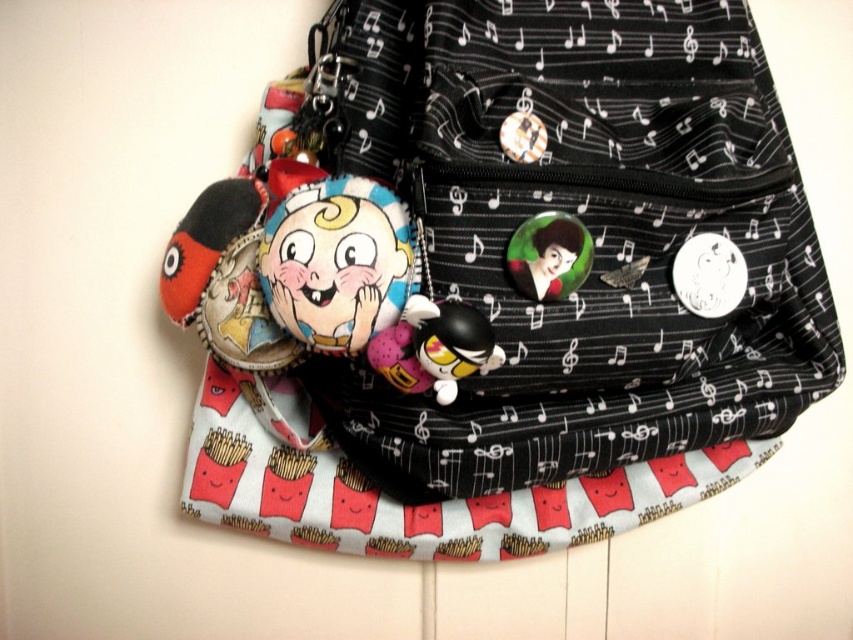
Question: In this image, where is soft plush toy at center located relative to shiny metallic button at center?

Choices:
 (A) below
 (B) above

Answer: (A)

Question: Which point is farther to the camera?

Choices:
 (A) shiny metallic button at center
 (B) soft plush toy at center
 (C) black fabric backpack at center

Answer: (A)

Question: Among these points, which one is nearest to the camera?

Choices:
 (A) (547, 276)
 (B) (689, 324)
 (C) (367, 252)

Answer: (C)

Question: Is black fabric backpack at center to the left of shiny metallic button at center from the viewer's perspective?

Choices:
 (A) yes
 (B) no

Answer: (A)

Question: Estimate the real-world distances between objects in this image. Which object is farther from the black fabric backpack at center?

Choices:
 (A) soft plush toy at center
 (B) shiny metallic button at center

Answer: (B)

Question: Is black fabric backpack at center smaller than soft plush toy at center?

Choices:
 (A) yes
 (B) no

Answer: (B)